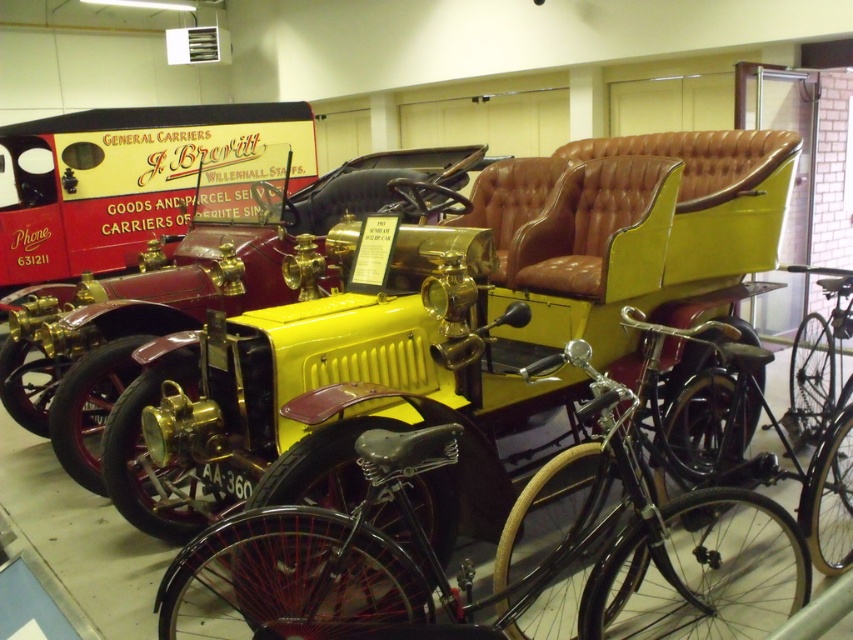
You are a museum curator planning to move the yellow leather car at center and the yellow matte car at center to a new exhibition hall. The entrance to the hall has a doorway that is 1.8 meters wide. Which car do you think will require more careful maneuvering due to its size?

The yellow leather car at center has a larger size compared to the yellow matte car at center, so it will require more careful maneuvering through the doorway.

You are a tour guide explaining the exhibits to a group. You need to move from the shiny black bicycle at center to the yellow early 20th century automobile with brass accents to the right. Is there enough space for a person to walk between them?

The distance between the shiny black bicycle at center and the yellow early 20th century automobile with brass accents to the right is 1.90 meters, which is sufficient for a person to walk between them comfortably.